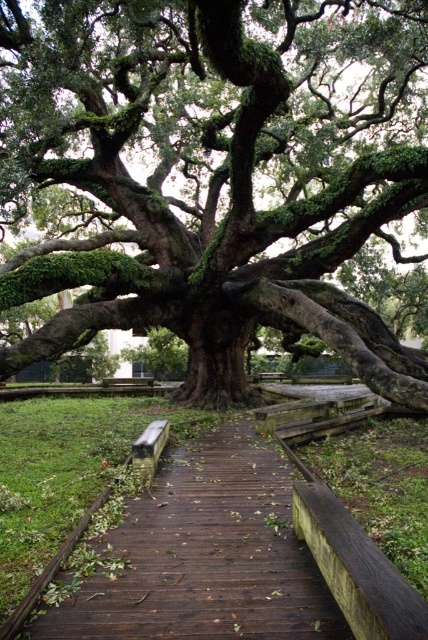
You are a park visitor carrying a picnic basket and want to sit on the wooden park bench at center. The green mossy oak tree at center has a trunk that is 1.2 meters in diameter. Can you safely walk between them without hitting the tree trunk?

The green mossy oak tree at center and wooden park bench at center are 9.45 meters apart from each other. Since the tree trunk is 1.2 meters in diameter, there is enough space between them for you to walk safely without hitting the tree trunk.

You are standing at the entrance of the wooden pathway in the image. A treasure map marks a spot at point (x=202, y=556). Which object on the path is exactly at that coordinate?

The brown wooden path at center is located at point (x=202, y=556).

You are standing on the brown wooden path at center and want to take a photo of the green mossy oak tree at center. Since the tree is taller than the path, will you need to tilt your camera upwards to capture the entire tree in the frame?

The green mossy oak tree at center is taller than the brown wooden path at center. To capture the entire tree in the frame, you would need to tilt your camera upwards as the tree extends higher above the path.